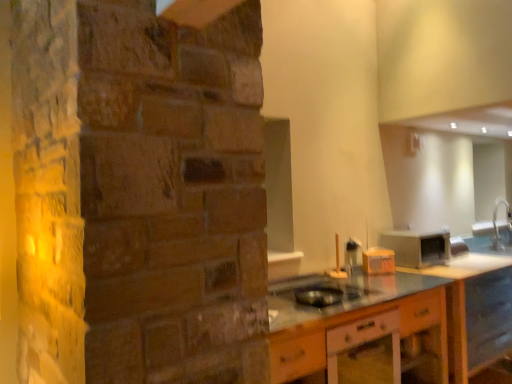
Locate an element on the screen. silver metallic faucet at right is located at coordinates (497, 226).

Where is `orange plastic toaster at center, arranged as the second appliance when viewed from the left`? orange plastic toaster at center, arranged as the second appliance when viewed from the left is located at coordinates (378, 261).

Describe the element at coordinates (417, 247) in the screenshot. I see `metallic silver toaster at right, positioned as the 3th appliance in front-to-back order` at that location.

Measure the distance between point (324,299) and camera.

8.06 feet.

The image size is (512, 384). Find the location of `silver metallic faucet at right`. silver metallic faucet at right is located at coordinates (497, 226).

Between silver metallic faucet at right and orange plastic toaster at center, placed as the 2th appliance when sorted from front to back, which one has less height?

Standing shorter between the two is orange plastic toaster at center, placed as the 2th appliance when sorted from front to back.

Based on the photo, is the position of silver metallic faucet at right less distant than that of orange plastic toaster at center, arranged as the second appliance when viewed from the left?

No, the depth of silver metallic faucet at right is greater than that of orange plastic toaster at center, arranged as the second appliance when viewed from the left.

Is silver metallic faucet at right placed right next to orange plastic toaster at center, which ranks as the 2th appliance in back-to-front order?

No, silver metallic faucet at right is not touching orange plastic toaster at center, which ranks as the 2th appliance in back-to-front order.

Measure the distance between silver metallic faucet at right and orange plastic toaster at center, which ranks as the 2th appliance in back-to-front order.

A distance of 1.54 meters exists between silver metallic faucet at right and orange plastic toaster at center, which ranks as the 2th appliance in back-to-front order.

In terms of height, does metallic silver toaster at right, acting as the first appliance starting from the back, look taller or shorter compared to black plastic bowl at center, which is counted as the 1th appliance, starting from the left?

Clearly, metallic silver toaster at right, acting as the first appliance starting from the back, is taller compared to black plastic bowl at center, which is counted as the 1th appliance, starting from the left.

Looking at this image, between metallic silver toaster at right, marked as the 3th appliance in a left-to-right arrangement, and black plastic bowl at center, which is the third appliance in back-to-front order, which one is positioned in front?

Positioned in front is black plastic bowl at center, which is the third appliance in back-to-front order.

Is metallic silver toaster at right, acting as the first appliance starting from the back, aimed at black plastic bowl at center, which is counted as the 1th appliance, starting from the left?

No, metallic silver toaster at right, acting as the first appliance starting from the back, does not turn towards black plastic bowl at center, which is counted as the 1th appliance, starting from the left.

Are metallic silver toaster at right, marked as the 3th appliance in a left-to-right arrangement, and black plastic bowl at center, which is counted as the third appliance, starting from the right, making contact?

No, metallic silver toaster at right, marked as the 3th appliance in a left-to-right arrangement, is not in contact with black plastic bowl at center, which is counted as the third appliance, starting from the right.

From the image's perspective, would you say silver metallic faucet at right is positioned over wooden cabinet at lower center?

Yes, from the image's perspective, silver metallic faucet at right is over wooden cabinet at lower center.

Which object is positioned more to the left, silver metallic faucet at right or wooden cabinet at lower center?

wooden cabinet at lower center.

Is silver metallic faucet at right in contact with wooden cabinet at lower center?

silver metallic faucet at right and wooden cabinet at lower center are not in contact.

Is metallic silver toaster at right, acting as the first appliance starting from the back, located outside silver metallic faucet at right?

Absolutely, metallic silver toaster at right, acting as the first appliance starting from the back, is external to silver metallic faucet at right.

Does metallic silver toaster at right, marked as the 3th appliance in a left-to-right arrangement, come behind silver metallic faucet at right?

No, metallic silver toaster at right, marked as the 3th appliance in a left-to-right arrangement, is closer to the viewer.

How many degrees apart are the facing directions of metallic silver toaster at right, positioned as the 3th appliance in front-to-back order, and silver metallic faucet at right?

The facing directions of metallic silver toaster at right, positioned as the 3th appliance in front-to-back order, and silver metallic faucet at right are 41.4 degrees apart.

Looking at this image, would you consider metallic silver toaster at right, positioned as the 3th appliance in front-to-back order, to be distant from silver metallic faucet at right?

Yes, metallic silver toaster at right, positioned as the 3th appliance in front-to-back order, is far from silver metallic faucet at right.

Where is `appliance that is the 3rd one above the wooden cabinet at lower center (from a real-world perspective)`? The width and height of the screenshot is (512, 384). appliance that is the 3rd one above the wooden cabinet at lower center (from a real-world perspective) is located at coordinates (378, 261).

Looking at this image, from the image's perspective, is wooden cabinet at lower center under orange plastic toaster at center, which ranks as the 2th appliance in back-to-front order?

Correct, wooden cabinet at lower center appears lower than orange plastic toaster at center, which ranks as the 2th appliance in back-to-front order, in the image.

Does point (436, 297) lie in front of point (377, 253)?

Yes.

Is wooden cabinet at lower center shorter than orange plastic toaster at center, arranged as the 2th appliance when viewed from the right?

In fact, wooden cabinet at lower center may be taller than orange plastic toaster at center, arranged as the 2th appliance when viewed from the right.

From the image's perspective, is metallic silver toaster at right, acting as the first appliance starting from the back, below wooden cabinet at lower center?

Actually, metallic silver toaster at right, acting as the first appliance starting from the back, appears above wooden cabinet at lower center in the image.

How different are the orientations of metallic silver toaster at right, acting as the first appliance starting from the back, and wooden cabinet at lower center in degrees?

The facing directions of metallic silver toaster at right, acting as the first appliance starting from the back, and wooden cabinet at lower center are 0.361 degrees apart.

Based on the photo, is metallic silver toaster at right, marked as the 3th appliance in a left-to-right arrangement, at the left side of wooden cabinet at lower center?

In fact, metallic silver toaster at right, marked as the 3th appliance in a left-to-right arrangement, is to the right of wooden cabinet at lower center.

Can you confirm if silver metallic faucet at right is shorter than metallic silver toaster at right, acting as the first appliance starting from the back?

No.

Does silver metallic faucet at right appear on the left side of metallic silver toaster at right, marked as the 3th appliance in a left-to-right arrangement?

Incorrect, silver metallic faucet at right is not on the left side of metallic silver toaster at right, marked as the 3th appliance in a left-to-right arrangement.

From a real-world perspective, is silver metallic faucet at right on metallic silver toaster at right, marked as the 3th appliance in a left-to-right arrangement?

Yes, from a real-world perspective, silver metallic faucet at right is above metallic silver toaster at right, marked as the 3th appliance in a left-to-right arrangement.

Who is bigger, silver metallic faucet at right or metallic silver toaster at right, which is the first appliance in right-to-left order?

Bigger between the two is metallic silver toaster at right, which is the first appliance in right-to-left order.

Locate an element on the screen. The height and width of the screenshot is (384, 512). faucet on the right of orange plastic toaster at center, which ranks as the 2th appliance in back-to-front order is located at coordinates (497, 226).

At what (x,y) coordinates should I click in order to perform the action: click on the 2nd appliance to the left of the metallic silver toaster at right, which is the first appliance in right-to-left order, counting from the anchor's position. Please return your answer as a coordinate pair (x, y). Looking at the image, I should click on (318, 295).

Based on their spatial positions, is silver metallic faucet at right or black plastic bowl at center, which is counted as the 1th appliance, starting from the left, closer to orange plastic toaster at center, which ranks as the 2th appliance in back-to-front order?

Based on the image, black plastic bowl at center, which is counted as the 1th appliance, starting from the left, appears to be nearer to orange plastic toaster at center, which ranks as the 2th appliance in back-to-front order.

Considering their positions, is black plastic bowl at center, arranged as the first appliance when viewed from the front, positioned further to metallic silver toaster at right, acting as the first appliance starting from the back, than wooden cabinet at lower center?

black plastic bowl at center, arranged as the first appliance when viewed from the front, is positioned further to the anchor metallic silver toaster at right, acting as the first appliance starting from the back.

Based on their spatial positions, is metallic silver toaster at right, which is the first appliance in right-to-left order, or silver metallic faucet at right closer to wooden cabinet at lower center?

Among the two, metallic silver toaster at right, which is the first appliance in right-to-left order, is located nearer to wooden cabinet at lower center.

Considering their positions, is orange plastic toaster at center, arranged as the second appliance when viewed from the left, positioned further to metallic silver toaster at right, acting as the first appliance starting from the back, than black plastic bowl at center, which is counted as the 1th appliance, starting from the left?

Based on the image, black plastic bowl at center, which is counted as the 1th appliance, starting from the left, appears to be further to metallic silver toaster at right, acting as the first appliance starting from the back.

Which object lies nearer to the anchor point orange plastic toaster at center, placed as the 2th appliance when sorted from front to back, wooden cabinet at lower center or black plastic bowl at center, arranged as the first appliance when viewed from the front?

Among the two, black plastic bowl at center, arranged as the first appliance when viewed from the front, is located nearer to orange plastic toaster at center, placed as the 2th appliance when sorted from front to back.

Which object lies further to the anchor point wooden cabinet at lower center, black plastic bowl at center, which is counted as the 1th appliance, starting from the left, or orange plastic toaster at center, placed as the 2th appliance when sorted from front to back?

orange plastic toaster at center, placed as the 2th appliance when sorted from front to back, lies further to wooden cabinet at lower center than the other object.

Based on their spatial positions, is orange plastic toaster at center, which ranks as the 2th appliance in back-to-front order, or silver metallic faucet at right closer to metallic silver toaster at right, which is the first appliance in right-to-left order?

orange plastic toaster at center, which ranks as the 2th appliance in back-to-front order, is closer to metallic silver toaster at right, which is the first appliance in right-to-left order.

Estimate the real-world distances between objects in this image. Which object is closer to orange plastic toaster at center, arranged as the 2th appliance when viewed from the right, wooden cabinet at lower center or metallic silver toaster at right, acting as the first appliance starting from the back?

metallic silver toaster at right, acting as the first appliance starting from the back, is positioned closer to the anchor orange plastic toaster at center, arranged as the 2th appliance when viewed from the right.

The height and width of the screenshot is (384, 512). I want to click on appliance located between black plastic bowl at center, which is the third appliance in back-to-front order, and metallic silver toaster at right, marked as the 3th appliance in a left-to-right arrangement, in the depth direction, so pyautogui.click(x=378, y=261).

At what (x,y) coordinates should I click in order to perform the action: click on appliance positioned between wooden cabinet at lower center and orange plastic toaster at center, arranged as the second appliance when viewed from the left, from near to far. Please return your answer as a coordinate pair (x, y). The width and height of the screenshot is (512, 384). Looking at the image, I should click on (318, 295).

At what (x,y) coordinates should I click in order to perform the action: click on appliance located between orange plastic toaster at center, arranged as the second appliance when viewed from the left, and silver metallic faucet at right in the left-right direction. Please return your answer as a coordinate pair (x, y). Looking at the image, I should click on (417, 247).

This screenshot has width=512, height=384. I want to click on cabinetry between black plastic bowl at center, which is the third appliance in back-to-front order, and silver metallic faucet at right, so click(x=350, y=321).